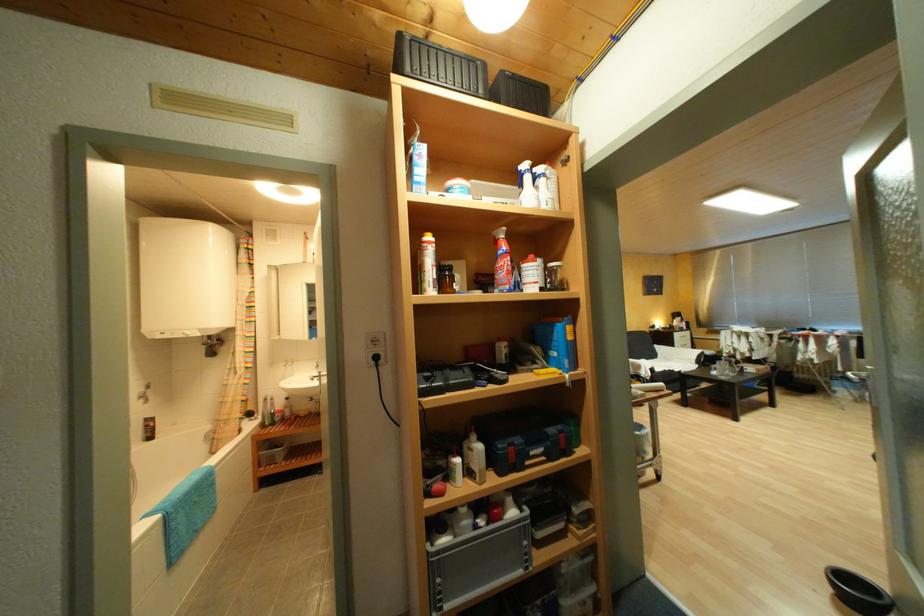
Find where to sit the sofa sitting surface. Please return your answer as a coordinate pair (x, y).

(660, 377)